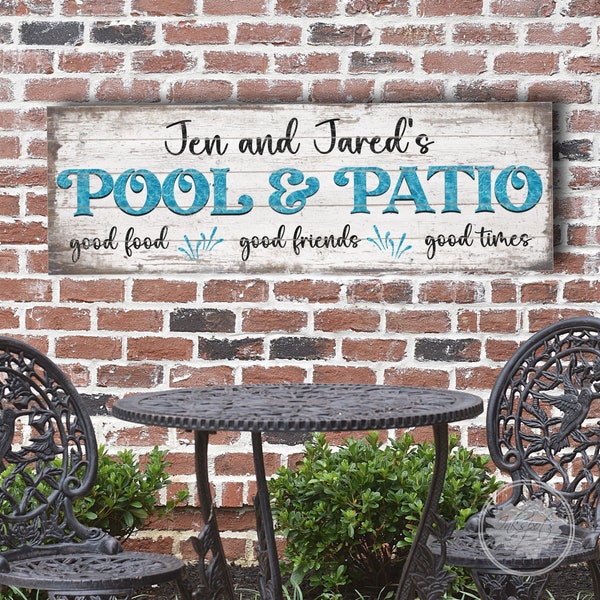
Identify the location of chair. (130, 559).